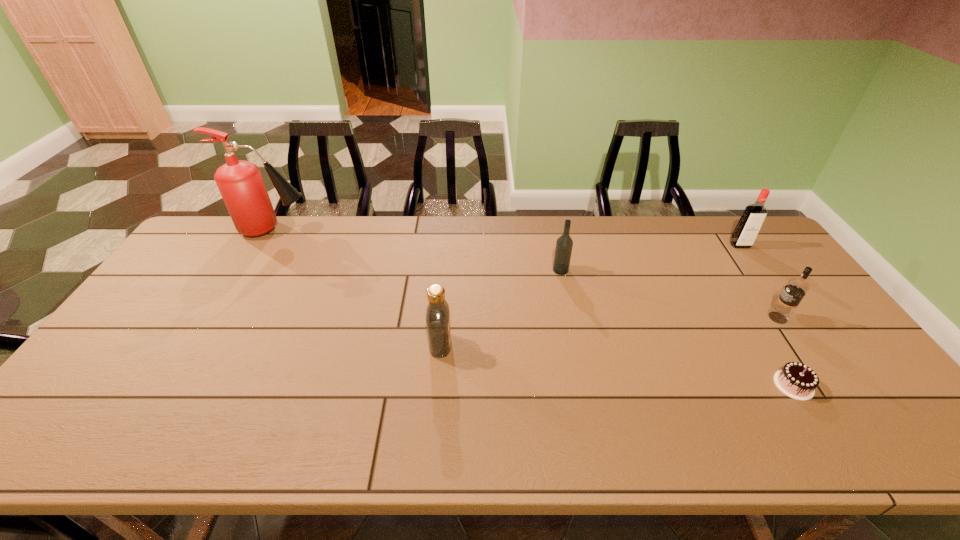
Find the location of a particular element. This screenshot has height=540, width=960. object that is the fifth closest to the fifth nearest object is located at coordinates (240, 183).

At what (x,y) coordinates should I click in order to perform the action: click on vodka that stands as the second closest to the third nearest object. Please return your answer as a coordinate pair (x, y). Image resolution: width=960 pixels, height=540 pixels. Looking at the image, I should click on tap(564, 244).

Identify which vodka is located as the third nearest to the shortest object. Please provide its 2D coordinates. Your answer should be formatted as a tuple, i.e. [(x, y)], where the tuple contains the x and y coordinates of a point satisfying the conditions above.

[(564, 244)]

Where is `vacant position in the image that satisfies the following two spatial constraints: 1. on the front-facing side of the nearest vodka; 2. on the left side of the chocolate cake`? This screenshot has width=960, height=540. vacant position in the image that satisfies the following two spatial constraints: 1. on the front-facing side of the nearest vodka; 2. on the left side of the chocolate cake is located at coordinates (437, 385).

At what (x,y) coordinates should I click in order to perform the action: click on free space that satisfies the following two spatial constraints: 1. on the back side of the chocolate cake; 2. with the nozzle aimed from the farthest object. Please return your answer as a coordinate pair (x, y). The width and height of the screenshot is (960, 540). Looking at the image, I should click on (697, 229).

You are a GUI agent. You are given a task and a screenshot of the screen. Output one action in this format:
    pyautogui.click(x=<x>, y=<y>)
    Task: Click on the vacant region that satisfies the following two spatial constraints: 1. on the front and back of the fifth nearest object; 2. on the front-facing side of the second object from left to right
    
    Given the screenshot: What is the action you would take?
    (x=811, y=345)

Where is `free point that satisfies the following two spatial constraints: 1. with the nozzle aimed from the tallest object; 2. on the left side of the third farthest object`? free point that satisfies the following two spatial constraints: 1. with the nozzle aimed from the tallest object; 2. on the left side of the third farthest object is located at coordinates (251, 270).

At what (x,y) coordinates should I click in order to perform the action: click on vacant position in the image that satisfies the following two spatial constraints: 1. on the front and back of the farthest vodka; 2. on the label of the third nearest object. Please return your answer as a coordinate pair (x, y). This screenshot has width=960, height=540. Looking at the image, I should click on (791, 318).

Where is `vacant area in the image that satisfies the following two spatial constraints: 1. with the nozzle aimed from the tallest object; 2. on the back side of the nearest object`? The height and width of the screenshot is (540, 960). vacant area in the image that satisfies the following two spatial constraints: 1. with the nozzle aimed from the tallest object; 2. on the back side of the nearest object is located at coordinates (183, 385).

You are a GUI agent. You are given a task and a screenshot of the screen. Output one action in this format:
    pyautogui.click(x=<x>, y=<y>)
    Task: Click on the vacant area in the image that satisfies the following two spatial constraints: 1. on the front side of the fourth object from right to left; 2. on the left side of the shortest object
    Image resolution: width=960 pixels, height=540 pixels.
    Given the screenshot: What is the action you would take?
    pyautogui.click(x=585, y=385)